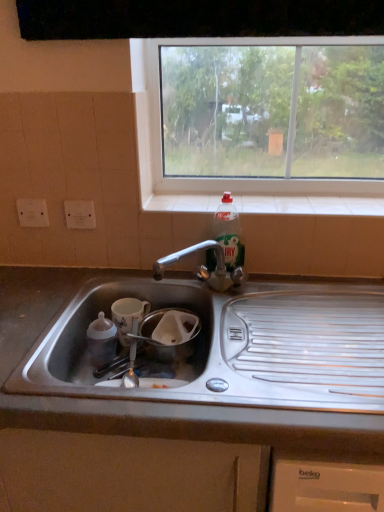
What are the coordinates of `vacant space situated on the left part of translucent plastic bottle at upper right` in the screenshot? It's located at (177, 277).